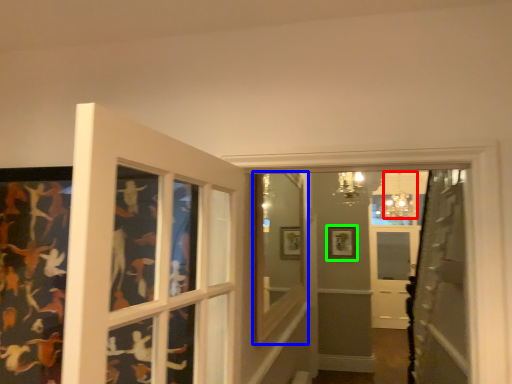
Question: Considering the real-world distances, which object is farthest from light fixture (highlighted by a red box)? window frame (highlighted by a blue box) or picture frame (highlighted by a green box)?

Choices:
 (A) window frame
 (B) picture frame

Answer: (A)